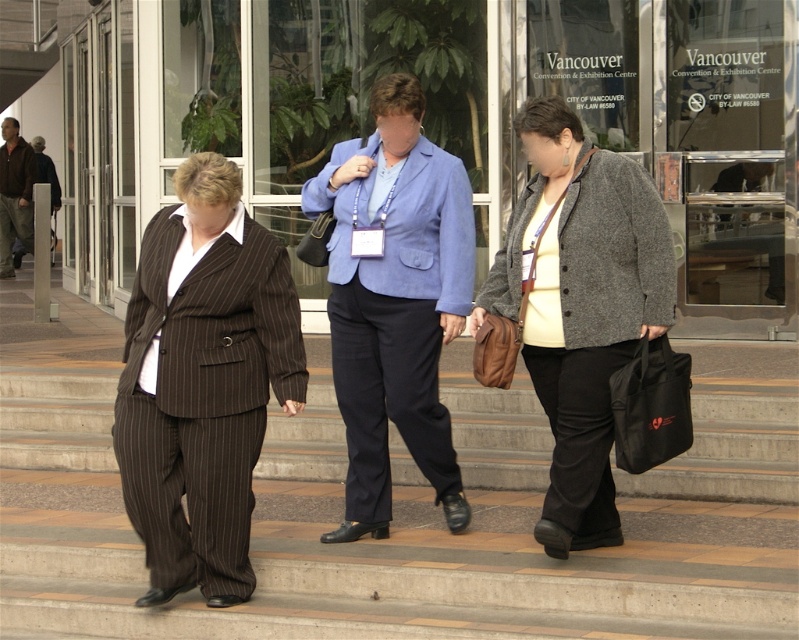
Question: Which point is closer to the camera?

Choices:
 (A) blue fabric business suit at center
 (B) brown pinstripe suit at center
 (C) brown leather jacket at left

Answer: (B)

Question: Which of the following is the farthest from the observer?

Choices:
 (A) blue fabric business suit at center
 (B) brown leather jacket at left
 (C) brown pinstripe suit at center
 (D) gray woolen jacket at center

Answer: (B)

Question: Among these objects, which one is nearest to the camera?

Choices:
 (A) brown leather jacket at left
 (B) brown pinstripe suit at center
 (C) blue fabric business suit at center
 (D) gray woolen jacket at center

Answer: (B)

Question: From the image, what is the correct spatial relationship of gray woolen jacket at center in relation to blue fabric business suit at center?

Choices:
 (A) right
 (B) left

Answer: (A)

Question: Is brown pinstripe suit at center positioned in front of brown leather jacket at left?

Choices:
 (A) yes
 (B) no

Answer: (A)

Question: Can you confirm if blue fabric business suit at center is thinner than brown leather jacket at left?

Choices:
 (A) yes
 (B) no

Answer: (B)